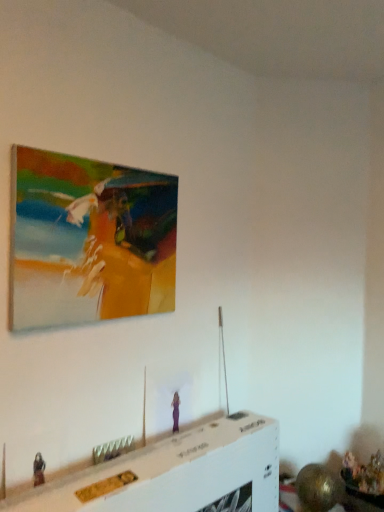
Image resolution: width=384 pixels, height=512 pixels. Describe the element at coordinates (88, 240) in the screenshot. I see `oil painting at upper left` at that location.

The image size is (384, 512). I want to click on oil painting at upper left, so click(88, 240).

Image resolution: width=384 pixels, height=512 pixels. I want to click on oil painting at upper left, so click(88, 240).